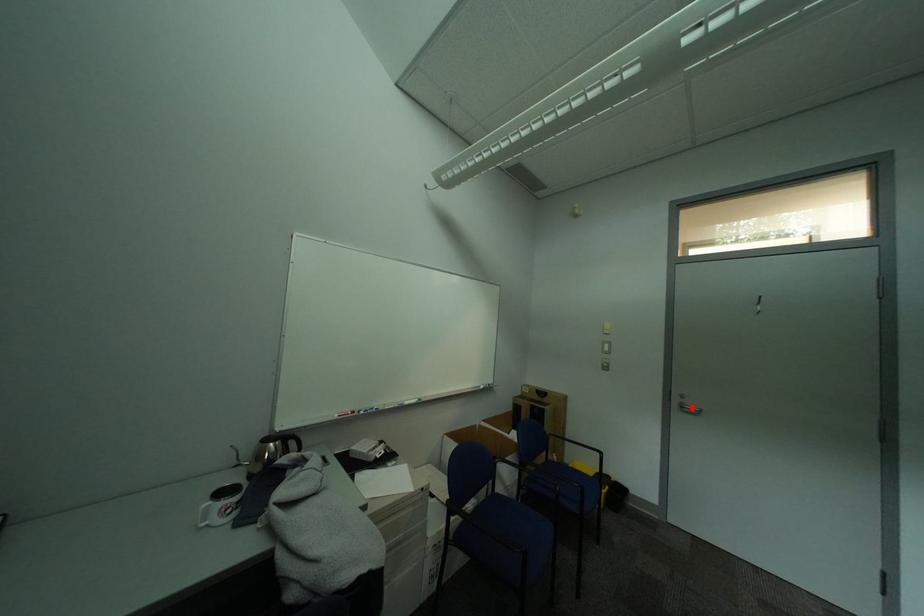
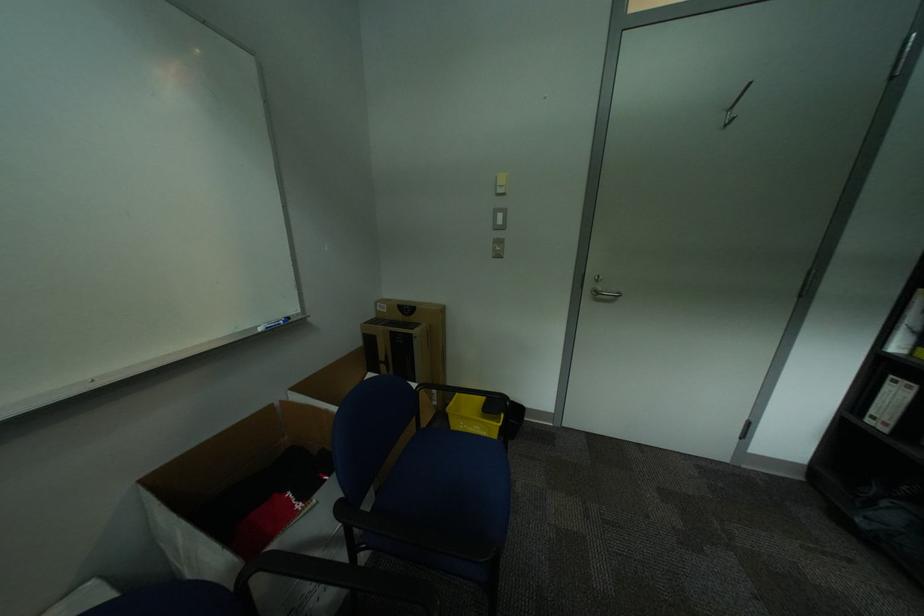
Question: I am providing you with two images of the same scene from different viewpoints. A red point is shown in image1. For the corresponding object point in image2, is it positioned nearer or farther from the camera?

Choices:
 (A) Nearer
 (B) Farther

Answer: (A)